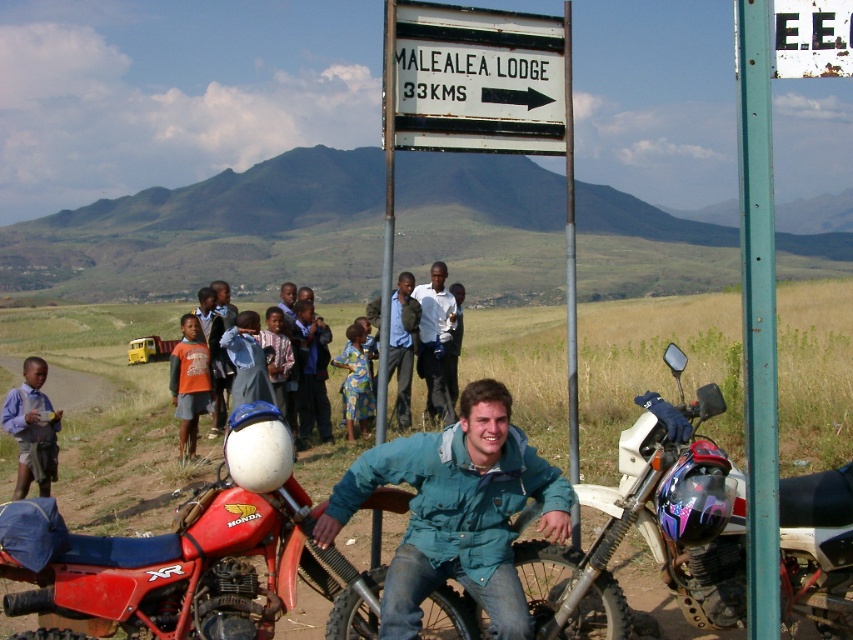
Who is higher up, white plastic sign at center or brown dirt track at lower left?

white plastic sign at center

Is point (419, 13) farther from viewer compared to point (86, 378)?

No, (419, 13) is in front of (86, 378).

Identify the location of white plastic sign at center. (476, 80).

Is red matte motorcycle at lower left above dark blue shirt at center?

Incorrect, red matte motorcycle at lower left is not positioned above dark blue shirt at center.

The width and height of the screenshot is (853, 640). What do you see at coordinates (181, 554) in the screenshot?
I see `red matte motorcycle at lower left` at bounding box center [181, 554].

At what (x,y) coordinates should I click in order to perform the action: click on red matte motorcycle at lower left. Please return your answer as a coordinate pair (x, y). The width and height of the screenshot is (853, 640). Looking at the image, I should click on (181, 554).

Does red matte motorcycle at lower left appear under printed fabric dress at center?

Yes.

Between red matte motorcycle at lower left and printed fabric dress at center, which one appears on the right side from the viewer's perspective?

Positioned to the right is printed fabric dress at center.

Is point (302, 516) closer to camera compared to point (355, 333)?

Yes, it is in front of point (355, 333).

The width and height of the screenshot is (853, 640). Find the location of `red matte motorcycle at lower left`. red matte motorcycle at lower left is located at coordinates (181, 554).